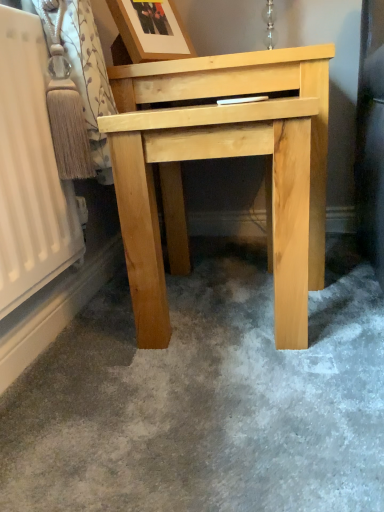
Image resolution: width=384 pixels, height=512 pixels. Identify the location of natural wood table at center. (218, 158).

This screenshot has height=512, width=384. What do you see at coordinates (218, 158) in the screenshot?
I see `natural wood table at center` at bounding box center [218, 158].

Image resolution: width=384 pixels, height=512 pixels. What are the coordinates of `wooden picture frame at upper center` in the screenshot? It's located at (151, 30).

The width and height of the screenshot is (384, 512). Describe the element at coordinates (151, 30) in the screenshot. I see `wooden picture frame at upper center` at that location.

In order to face wooden picture frame at upper center, should I rotate leftwards or rightwards?

Turn left by 6.016 degrees to look at wooden picture frame at upper center.

Find the location of `natural wood table at center`. natural wood table at center is located at coordinates (218, 158).

Does natural wood table at center appear on the right side of wooden picture frame at upper center?

Correct, you'll find natural wood table at center to the right of wooden picture frame at upper center.

Between natural wood table at center and wooden picture frame at upper center, which one is positioned behind?

wooden picture frame at upper center is further from the camera.

Between point (177, 202) and point (129, 42), which one is positioned in front?

The point (129, 42) is more forward.

From the image's perspective, between natural wood table at center and wooden picture frame at upper center, who is located below?

natural wood table at center is shown below in the image.

From a real-world perspective, which is physically above, natural wood table at center or wooden picture frame at upper center?

wooden picture frame at upper center, from a real-world perspective.

Which object is wider, natural wood table at center or wooden picture frame at upper center?

With larger width is natural wood table at center.

Who is shorter, natural wood table at center or wooden picture frame at upper center?

With less height is wooden picture frame at upper center.

Is natural wood table at center smaller than wooden picture frame at upper center?

Actually, natural wood table at center might be larger than wooden picture frame at upper center.

Is natural wood table at center spatially inside wooden picture frame at upper center, or outside of it?

natural wood table at center is not enclosed by wooden picture frame at upper center.

Is natural wood table at center directly adjacent to wooden picture frame at upper center?

natural wood table at center is not next to wooden picture frame at upper center, and they're not touching.

Is natural wood table at center facing away from wooden picture frame at upper center?

natural wood table at center is not turned away from wooden picture frame at upper center.

How different are the orientations of natural wood table at center and wooden picture frame at upper center in degrees?

60.2 degrees separate the facing orientations of natural wood table at center and wooden picture frame at upper center.

You are a GUI agent. You are given a task and a screenshot of the screen. Output one action in this format:
    pyautogui.click(x=<x>, y=<y>)
    Task: Click on the picture frame above the natural wood table at center (from the image's perspective)
    The image size is (384, 512).
    Given the screenshot: What is the action you would take?
    pyautogui.click(x=151, y=30)

Considering the positions of objects wooden picture frame at upper center and natural wood table at center in the image provided, who is more to the right, wooden picture frame at upper center or natural wood table at center?

From the viewer's perspective, natural wood table at center appears more on the right side.

Which object is further away from the camera, wooden picture frame at upper center or natural wood table at center?

Positioned behind is wooden picture frame at upper center.

Considering the points (159, 18) and (297, 190), which point is in front, point (159, 18) or point (297, 190)?

Positioned in front is point (297, 190).

From the image's perspective, is wooden picture frame at upper center above natural wood table at center?

Yes, from the image's perspective, wooden picture frame at upper center is on top of natural wood table at center.

From a real-world perspective, which is physically below, wooden picture frame at upper center or natural wood table at center?

natural wood table at center is physically lower.

Can you confirm if wooden picture frame at upper center is wider than natural wood table at center?

Incorrect, the width of wooden picture frame at upper center does not surpass that of natural wood table at center.

Which of these two, wooden picture frame at upper center or natural wood table at center, stands taller?

Standing taller between the two is natural wood table at center.

Which of these two, wooden picture frame at upper center or natural wood table at center, is smaller?

wooden picture frame at upper center.

Is wooden picture frame at upper center inside the boundaries of natural wood table at center, or outside?

wooden picture frame at upper center is outside natural wood table at center.

Is wooden picture frame at upper center touching natural wood table at center?

No, wooden picture frame at upper center is not touching natural wood table at center.

Is wooden picture frame at upper center turned away from natural wood table at center?

No, wooden picture frame at upper center is not facing away from natural wood table at center.

The height and width of the screenshot is (512, 384). Identify the location of table lying below the wooden picture frame at upper center (from the image's perspective). (218, 158).

This screenshot has width=384, height=512. Identify the location of table below the wooden picture frame at upper center (from the image's perspective). (218, 158).

Find the location of `picture frame on the left of natural wood table at center`. picture frame on the left of natural wood table at center is located at coordinates (151, 30).